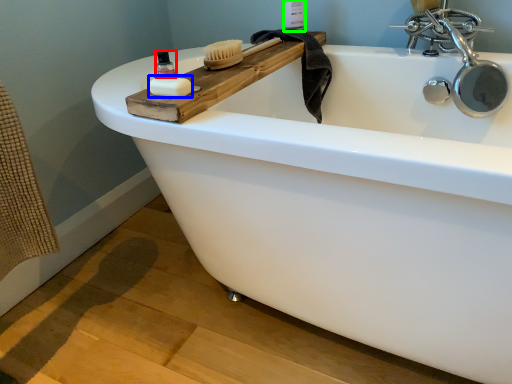
Question: Which object is positioned closest to mouthwash (highlighted by a red box)? Select from soap (highlighted by a blue box) and toiletry (highlighted by a green box).

Choices:
 (A) soap
 (B) toiletry

Answer: (A)